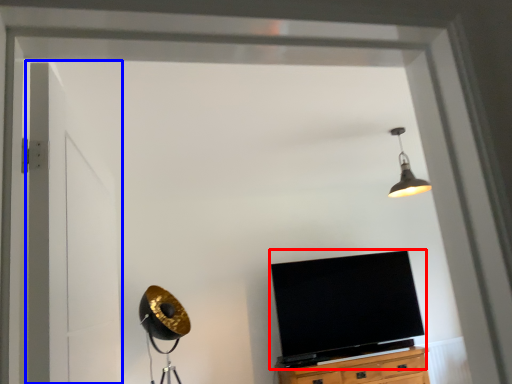
Question: Which of the following is the closest to the observer, television (highlighted by a red box) or door (highlighted by a blue box)?

Choices:
 (A) television
 (B) door

Answer: (B)